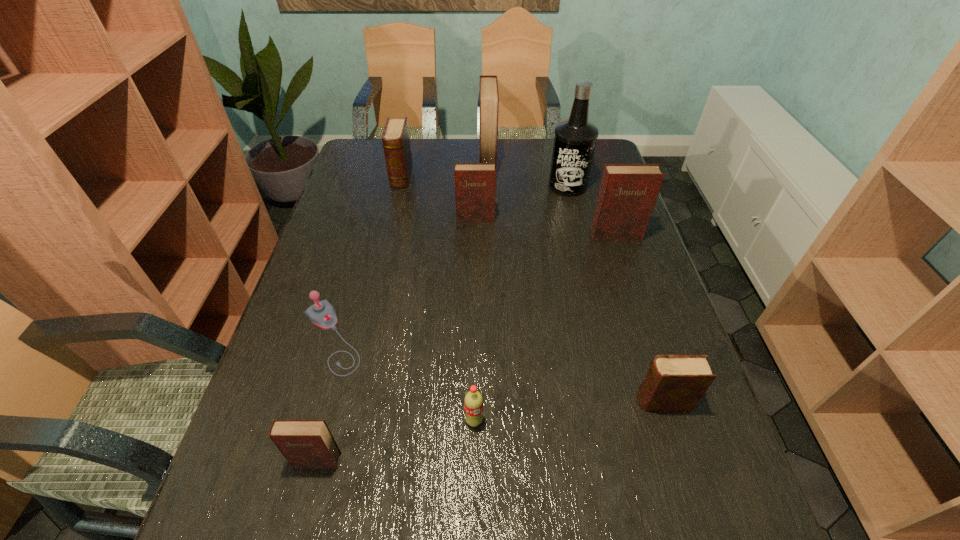
You are a GUI agent. You are given a task and a screenshot of the screen. Output one action in this format:
    pyautogui.click(x=<x>, y=<y>)
    Task: Click on the free space between the tallest object and the third tallest object
    
    Given the screenshot: What is the action you would take?
    pyautogui.click(x=591, y=211)

Find the location of a particular element. This screenshot has height=540, width=960. free point between the tallest diary and the nearer brown diary is located at coordinates (x=575, y=282).

You are a GUI agent. You are given a task and a screenshot of the screen. Output one action in this format:
    pyautogui.click(x=<x>, y=<y>)
    Task: Click on the vacant point located between the fourth farthest diary and the third nearest reddish-brown diary
    This screenshot has height=540, width=960.
    Given the screenshot: What is the action you would take?
    pyautogui.click(x=545, y=227)

Where is `free space that is in between the second tallest object and the liquor`? The width and height of the screenshot is (960, 540). free space that is in between the second tallest object and the liquor is located at coordinates pyautogui.click(x=528, y=174).

I want to click on free space that is in between the red soda and the fifth farthest diary, so click(x=568, y=411).

You are a GUI agent. You are given a task and a screenshot of the screen. Output one action in this format:
    pyautogui.click(x=<x>, y=<y>)
    Task: Click on the vacant area that lies between the third tallest object and the left brown diary
    This screenshot has width=960, height=540.
    Given the screenshot: What is the action you would take?
    (509, 206)

This screenshot has width=960, height=540. What are the coordinates of `vacant point located between the rightmost reddish-brown diary and the nearest reddish-brown diary` in the screenshot? It's located at (467, 348).

Locate which object is the seventh closest to the fourth farthest object. Please provide its 2D coordinates. Your answer should be formatted as a tuple, i.e. [(x, y)], where the tuple contains the x and y coordinates of a point satisfying the conditions above.

[(673, 382)]

Point out which object is positioned as the fifth nearest to the seventh farthest object. Please provide its 2D coordinates. Your answer should be formatted as a tuple, i.e. [(x, y)], where the tuple contains the x and y coordinates of a point satisfying the conditions above.

[(475, 183)]

Locate an element on the screen. This screenshot has height=540, width=960. diary that is the fourth closest to the joystick is located at coordinates (673, 382).